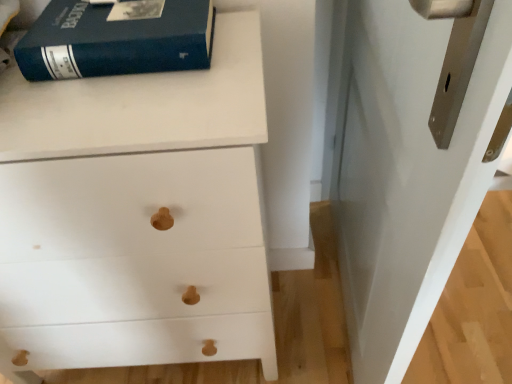
Question: Is white matte wood chest of drawers at upper left smaller than white glossy door at upper right?

Choices:
 (A) no
 (B) yes

Answer: (A)

Question: Can white glossy door at upper right be found inside white matte wood chest of drawers at upper left?

Choices:
 (A) yes
 (B) no

Answer: (B)

Question: Is the surface of white matte wood chest of drawers at upper left in direct contact with white glossy door at upper right?

Choices:
 (A) no
 (B) yes

Answer: (A)

Question: Does white matte wood chest of drawers at upper left have a greater height compared to white glossy door at upper right?

Choices:
 (A) yes
 (B) no

Answer: (B)

Question: Can you confirm if white matte wood chest of drawers at upper left is bigger than white glossy door at upper right?

Choices:
 (A) yes
 (B) no

Answer: (A)

Question: Looking at the image, does white matte wood chest of drawers at upper left seem bigger or smaller compared to white glossy door at upper right?

Choices:
 (A) small
 (B) big

Answer: (B)

Question: Choose the correct answer: Is white matte wood chest of drawers at upper left inside white glossy door at upper right or outside it?

Choices:
 (A) outside
 (B) inside

Answer: (A)

Question: Is white matte wood chest of drawers at upper left in front of or behind white glossy door at upper right in the image?

Choices:
 (A) behind
 (B) front

Answer: (A)

Question: Looking at their shapes, would you say white matte wood chest of drawers at upper left is wider or thinner than white glossy door at upper right?

Choices:
 (A) wide
 (B) thin

Answer: (A)

Question: In terms of height, does white glossy door at upper right look taller or shorter compared to white matte wood chest of drawers at upper left?

Choices:
 (A) short
 (B) tall

Answer: (B)

Question: Would you say white glossy door at upper right is to the left or to the right of white matte wood chest of drawers at upper left in the picture?

Choices:
 (A) right
 (B) left

Answer: (A)

Question: In terms of width, does white glossy door at upper right look wider or thinner when compared to white matte wood chest of drawers at upper left?

Choices:
 (A) thin
 (B) wide

Answer: (A)

Question: Is white glossy door at upper right in front of or behind white matte wood chest of drawers at upper left in the image?

Choices:
 (A) behind
 (B) front

Answer: (B)

Question: Considering the positions of point (375, 11) and point (126, 56), is point (375, 11) closer or farther from the camera than point (126, 56)?

Choices:
 (A) farther
 (B) closer

Answer: (A)

Question: From a real-world perspective, relative to matte blue book at upper left, is white glossy door at upper right vertically above or below?

Choices:
 (A) above
 (B) below

Answer: (B)